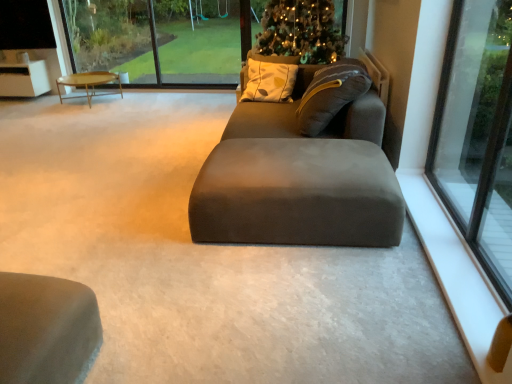
Where is `free location to the left of suede-like gray studio couch at center`? The image size is (512, 384). free location to the left of suede-like gray studio couch at center is located at coordinates (138, 217).